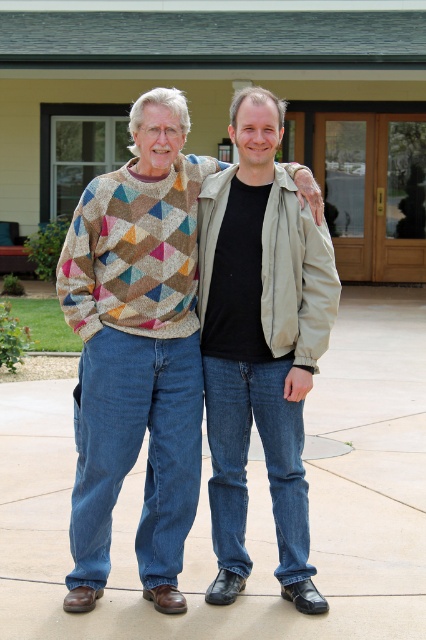
Question: Among these objects, which one is farthest from the camera?

Choices:
 (A) multicolored knitted sweater at center
 (B) matte beige jacket at center

Answer: (B)

Question: Is multicolored knitted sweater at center positioned at the back of matte beige jacket at center?

Choices:
 (A) yes
 (B) no

Answer: (B)

Question: Is multicolored knitted sweater at center thinner than matte beige jacket at center?

Choices:
 (A) no
 (B) yes

Answer: (A)

Question: Can you confirm if multicolored knitted sweater at center is positioned to the right of matte beige jacket at center?

Choices:
 (A) no
 (B) yes

Answer: (A)

Question: Which of the following is the closest to the observer?

Choices:
 (A) matte beige jacket at center
 (B) multicolored knitted sweater at center

Answer: (B)

Question: Which object is closer to the camera taking this photo?

Choices:
 (A) matte beige jacket at center
 (B) multicolored knitted sweater at center

Answer: (B)